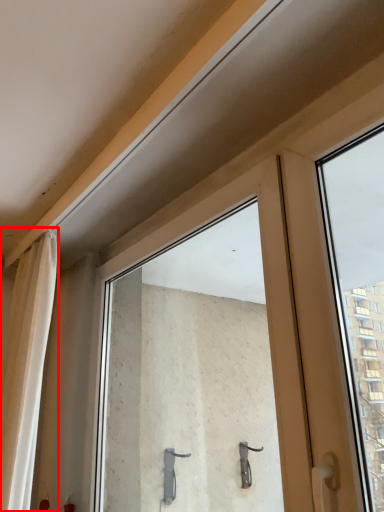
Question: From the image's perspective, where is curtain (annotated by the red box) located in relation to window in the image?

Choices:
 (A) below
 (B) above

Answer: (A)